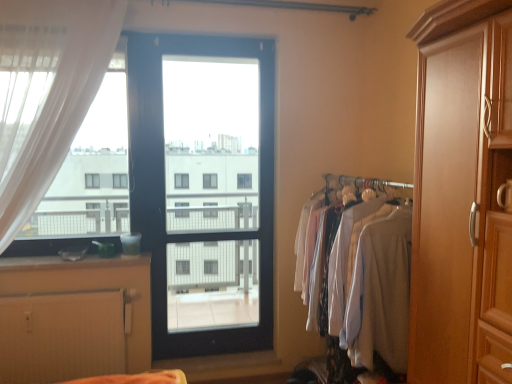
Question: Is light gray fabric shirts at right facing away from white textured radiator at lower left?

Choices:
 (A) no
 (B) yes

Answer: (A)

Question: Does light gray fabric shirts at right have a greater width compared to white textured radiator at lower left?

Choices:
 (A) no
 (B) yes

Answer: (B)

Question: Considering the relative sizes of light gray fabric shirts at right and white textured radiator at lower left in the image provided, is light gray fabric shirts at right taller than white textured radiator at lower left?

Choices:
 (A) yes
 (B) no

Answer: (A)

Question: Is the depth of light gray fabric shirts at right less than that of white textured radiator at lower left?

Choices:
 (A) yes
 (B) no

Answer: (A)

Question: From the image's perspective, is light gray fabric shirts at right above white textured radiator at lower left?

Choices:
 (A) no
 (B) yes

Answer: (B)

Question: Is light gray fabric shirts at right not inside white textured radiator at lower left?

Choices:
 (A) no
 (B) yes

Answer: (B)

Question: Are white sheer curtain at left and black glass door at center making contact?

Choices:
 (A) no
 (B) yes

Answer: (A)

Question: Considering the relative sizes of white sheer curtain at left and black glass door at center in the image provided, is white sheer curtain at left thinner than black glass door at center?

Choices:
 (A) yes
 (B) no

Answer: (B)

Question: Is the position of white sheer curtain at left less distant than that of black glass door at center?

Choices:
 (A) yes
 (B) no

Answer: (A)

Question: From a real-world perspective, does white sheer curtain at left sit lower than black glass door at center?

Choices:
 (A) yes
 (B) no

Answer: (B)

Question: Is white sheer curtain at left oriented towards black glass door at center?

Choices:
 (A) yes
 (B) no

Answer: (B)

Question: Is white sheer curtain at left shorter than black glass door at center?

Choices:
 (A) no
 (B) yes

Answer: (B)

Question: From the image's perspective, is black glass door at center on white textured radiator at lower left?

Choices:
 (A) no
 (B) yes

Answer: (B)